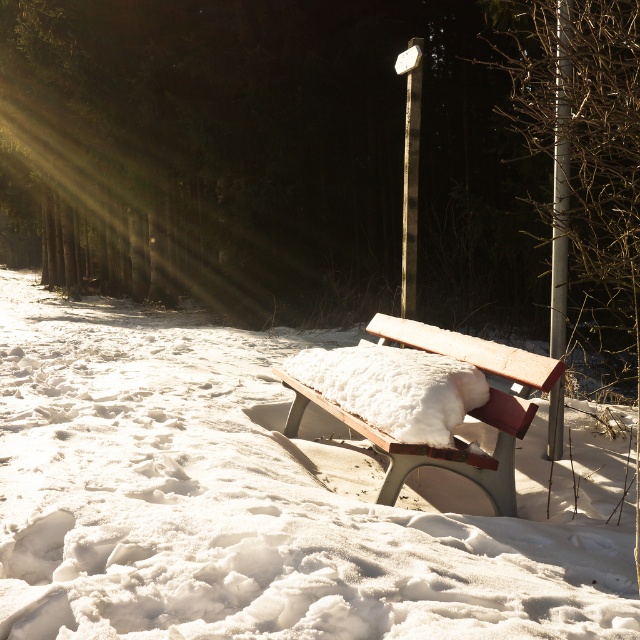
You are a hiker who wants to place a 3 feet long hiking pole between the white fluffy snow at center and the metallic pole at right. Can you fit it there without overlapping either object?

The distance between the white fluffy snow at center and the metallic pole at right is 7.68 feet. Since the hiking pole is only 3 feet long, there is enough space to place it between them without overlapping either object.

You are an artist trying to paint the winter scene. You want to emphasize the contrast between the white fluffy snow at center and the metallic pole at upper center. Which object should you make larger in your painting to highlight this contrast?

The white fluffy snow at center is larger in size than the metallic pole at upper center, so to emphasize the contrast, you should paint the white fluffy snow at center larger than the metallic pole at upper center.